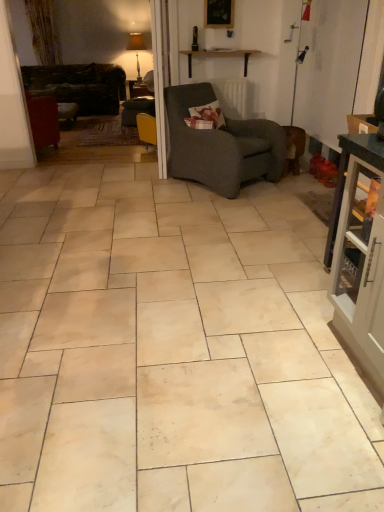
Where is `free space to the back side of matte gray cabinet at right`? This screenshot has height=512, width=384. free space to the back side of matte gray cabinet at right is located at coordinates (298, 301).